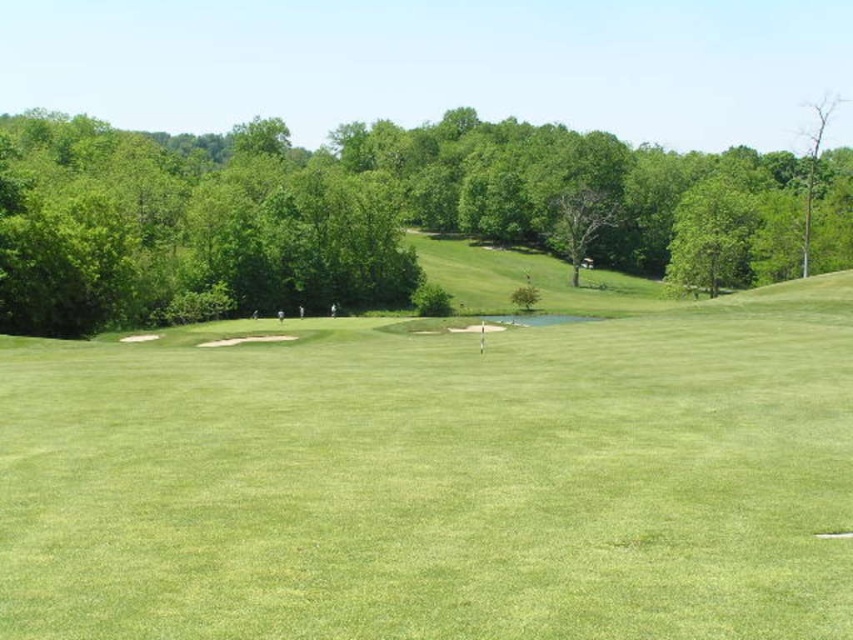
Is green grassy field at center positioned in front of green leafy tree at upper center?

Yes, green grassy field at center is in front of green leafy tree at upper center.

Does green grassy field at center have a larger size compared to green leafy tree at upper center?

No.

Does point (428, 401) come in front of point (50, 314)?

Yes, it is.

The width and height of the screenshot is (853, 640). In order to click on green grassy field at center in this screenshot , I will do `click(437, 480)`.